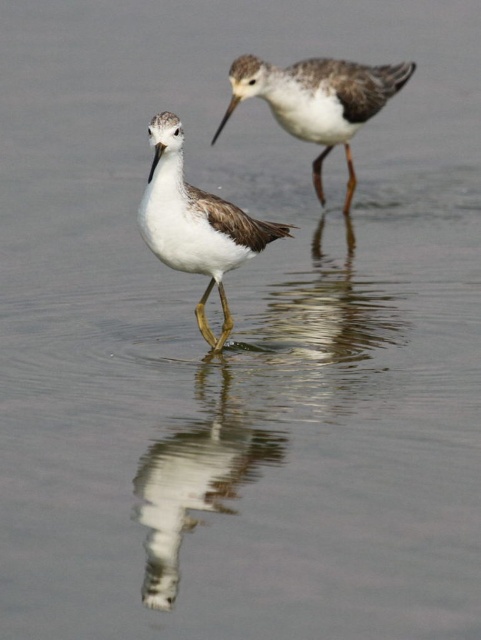
Question: Does white glossy bird at center come behind white matte bird at upper center?

Choices:
 (A) yes
 (B) no

Answer: (B)

Question: Where is white glossy bird at center located in relation to white matte bird at center in the image?

Choices:
 (A) above
 (B) below

Answer: (B)

Question: Does white matte bird at center appear under white matte bird at upper center?

Choices:
 (A) no
 (B) yes

Answer: (B)

Question: Which object is the farthest from the white matte bird at center?

Choices:
 (A) white matte bird at upper center
 (B) white glossy bird at center

Answer: (A)

Question: Which of these objects is positioned closest to the white glossy bird at center?

Choices:
 (A) white glossy bird reflection at center
 (B) white matte bird at center
 (C) white matte bird at upper center

Answer: (A)

Question: Which object appears farthest from the camera in this image?

Choices:
 (A) white glossy bird at center
 (B) white matte bird at center
 (C) white glossy bird reflection at center

Answer: (B)